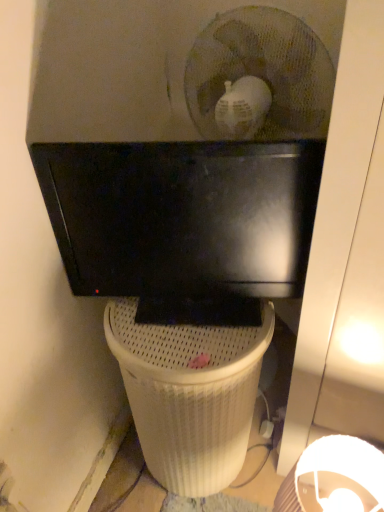
The image size is (384, 512). Describe the element at coordinates (184, 223) in the screenshot. I see `matte black monitor at upper center` at that location.

You are a GUI agent. You are given a task and a screenshot of the screen. Output one action in this format:
    pyautogui.click(x=<x>, y=<y>)
    Task: Click on the matte black monitor at upper center
    
    Given the screenshot: What is the action you would take?
    pyautogui.click(x=184, y=223)

What do you see at coordinates (189, 395) in the screenshot?
I see `white mesh waste container at center` at bounding box center [189, 395].

What is the approximate height of white mesh waste container at center?

white mesh waste container at center is 23.78 inches tall.

Where is `white mesh waste container at center`? This screenshot has width=384, height=512. white mesh waste container at center is located at coordinates (189, 395).

You are a GUI agent. You are given a task and a screenshot of the screen. Output one action in this format:
    pyautogui.click(x=<x>, y=<y>)
    Task: Click on the matte black monitor at upper center
    
    Given the screenshot: What is the action you would take?
    pyautogui.click(x=184, y=223)

Can you confirm if matte black monitor at upper center is positioned to the right of white mesh waste container at center?

Yes, matte black monitor at upper center is to the right of white mesh waste container at center.

Does matte black monitor at upper center lie behind white mesh waste container at center?

No, matte black monitor at upper center is closer to the camera.

Which is nearer, (194, 197) or (170, 424)?

Point (194, 197) appears to be closer to the viewer than point (170, 424).

From the image's perspective, which is below, matte black monitor at upper center or white mesh waste container at center?

white mesh waste container at center appears lower in the image.

From a real-world perspective, is matte black monitor at upper center under white mesh waste container at center?

Incorrect, from a real-world perspective, matte black monitor at upper center is higher than white mesh waste container at center.

Which object is wider, matte black monitor at upper center or white mesh waste container at center?

white mesh waste container at center.

Considering the relative sizes of matte black monitor at upper center and white mesh waste container at center in the image provided, is matte black monitor at upper center shorter than white mesh waste container at center?

Correct, matte black monitor at upper center is not as tall as white mesh waste container at center.

Between matte black monitor at upper center and white mesh waste container at center, which one has larger size?

white mesh waste container at center is bigger.

Is matte black monitor at upper center spatially inside white mesh waste container at center, or outside of it?

matte black monitor at upper center is spatially situated outside white mesh waste container at center.

Would you say matte black monitor at upper center is a long distance from white mesh waste container at center?

Actually, matte black monitor at upper center and white mesh waste container at center are a little close together.

Is matte black monitor at upper center aimed at white mesh waste container at center?

No, matte black monitor at upper center is not oriented towards white mesh waste container at center.

This screenshot has height=512, width=384. What are the coordinates of `waste container to the left of matte black monitor at upper center` in the screenshot? It's located at (189, 395).

Which is more to the right, white mesh waste container at center or matte black monitor at upper center?

From the viewer's perspective, matte black monitor at upper center appears more on the right side.

Considering their positions, is white mesh waste container at center located in front of or behind matte black monitor at upper center?

white mesh waste container at center is positioned farther from the viewer than matte black monitor at upper center.

Which is closer to the camera, [228,371] or [286,234]?

Point [228,371] is positioned closer to the camera compared to point [286,234].

From the image's perspective, is white mesh waste container at center on top of matte black monitor at upper center?

Incorrect, from the image's perspective, white mesh waste container at center is lower than matte black monitor at upper center.

From a real-world perspective, is white mesh waste container at center positioned over matte black monitor at upper center based on gravity?

Incorrect, from a real-world perspective, white mesh waste container at center is lower than matte black monitor at upper center.

Consider the image. Does white mesh waste container at center have a greater width compared to matte black monitor at upper center?

Yes.

Considering the relative sizes of white mesh waste container at center and matte black monitor at upper center in the image provided, is white mesh waste container at center taller than matte black monitor at upper center?

Indeed, white mesh waste container at center has a greater height compared to matte black monitor at upper center.

Is white mesh waste container at center smaller than matte black monitor at upper center?

Actually, white mesh waste container at center might be larger than matte black monitor at upper center.

Would you say white mesh waste container at center is inside or outside matte black monitor at upper center?

white mesh waste container at center lies outside matte black monitor at upper center.

Is white mesh waste container at center far away from matte black monitor at upper center?

That's not correct — white mesh waste container at center is a little close to matte black monitor at upper center.

Does white mesh waste container at center turn towards matte black monitor at upper center?

No, white mesh waste container at center is not turned towards matte black monitor at upper center.

How many degrees apart are the facing directions of white mesh waste container at center and matte black monitor at upper center?

The angular difference between white mesh waste container at center and matte black monitor at upper center is 18.6 degrees.

In order to click on computer monitor that is in front of the white mesh waste container at center in this screenshot , I will do `click(184, 223)`.

What are the coordinates of `computer monitor that appears in front of the white mesh waste container at center` in the screenshot? It's located at (184, 223).

This screenshot has height=512, width=384. What are the coordinates of `computer monitor located above the white mesh waste container at center (from the image's perspective)` in the screenshot? It's located at (184, 223).